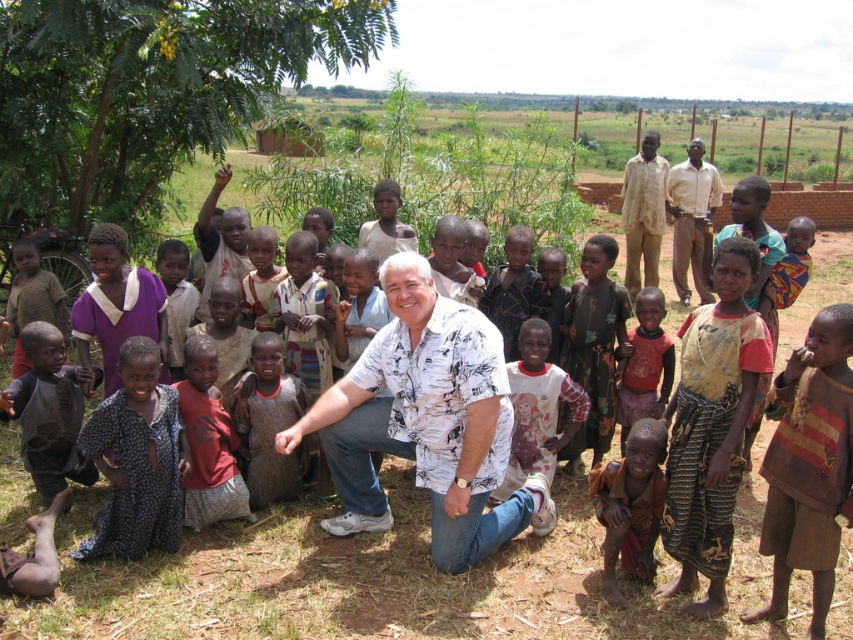
You are a photographer taking a picture of the group. You notice the red cotton shirt at lower left and the light brown shirt at upper right. Which one is closer to the camera?

The red cotton shirt at lower left is closer to the camera because it is in front of the light brown shirt at upper right.

You are taking a photo of the group and notice the brown striped shirt at lower right and the red cotton shirt at lower left. Which shirt should you focus on first to ensure it appears sharp in the photo?

The brown striped shirt at lower right is closer to the viewer than the red cotton shirt at lower left, so focusing on the brown striped shirt at lower right first will ensure it appears sharp in the photo.